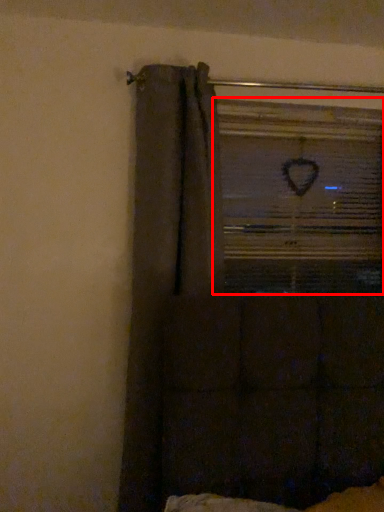
Question: From the image's perspective, where is window frame (annotated by the red box) located relative to curtain?

Choices:
 (A) above
 (B) below

Answer: (A)